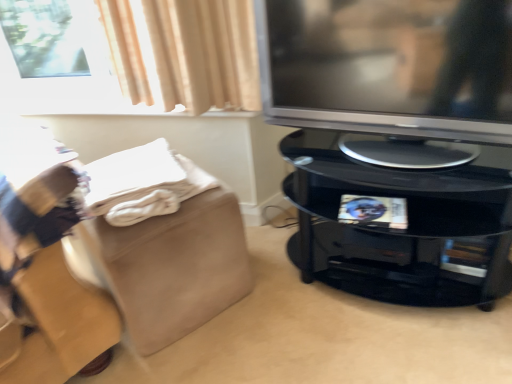
This screenshot has width=512, height=384. What do you see at coordinates (401, 229) in the screenshot?
I see `glossy black tv stand at right` at bounding box center [401, 229].

You are a GUI agent. You are given a task and a screenshot of the screen. Output one action in this format:
    pyautogui.click(x=<x>, y=<y>)
    Task: Click on the white soft blanket at lower left
    The image size is (512, 384).
    Given the screenshot: What is the action you would take?
    pyautogui.click(x=143, y=183)

What do you see at coordinates (175, 267) in the screenshot? I see `beige suede footrest at lower left` at bounding box center [175, 267].

Find the location of a particular element. satin silver television at right is located at coordinates (389, 66).

Is beige suede footrest at lower left aimed at glossy black tv stand at right?

No, beige suede footrest at lower left is not turned towards glossy black tv stand at right.

Is beige suede footrest at lower left to the right of glossy black tv stand at right from the viewer's perspective?

Incorrect, beige suede footrest at lower left is not on the right side of glossy black tv stand at right.

Considering the sizes of beige suede footrest at lower left and glossy black tv stand at right in the image, is beige suede footrest at lower left taller or shorter than glossy black tv stand at right?

Clearly, beige suede footrest at lower left is shorter compared to glossy black tv stand at right.

Considering the sizes of objects beige suede footrest at lower left and glossy black tv stand at right in the image provided, who is bigger, beige suede footrest at lower left or glossy black tv stand at right?

With larger size is glossy black tv stand at right.

From a real-world perspective, which is physically below, white soft blanket at lower left or beige suede footrest at lower left?

In real-world perspective, beige suede footrest at lower left is lower.

Is there a large distance between white soft blanket at lower left and beige suede footrest at lower left?

They are positioned close to each other.

Is white soft blanket at lower left further to the viewer compared to beige suede footrest at lower left?

No, it is in front of beige suede footrest at lower left.

Image resolution: width=512 pixels, height=384 pixels. In order to click on blanket that is above the beige suede footrest at lower left (from a real-world perspective) in this screenshot , I will do `click(143, 183)`.

From the image's perspective, is glossy black tv stand at right located beneath white soft blanket at lower left?

Correct, glossy black tv stand at right appears lower than white soft blanket at lower left in the image.

Is the position of glossy black tv stand at right less distant than that of white soft blanket at lower left?

Yes, it is.

From a real-world perspective, between glossy black tv stand at right and white soft blanket at lower left, who is vertically higher?

white soft blanket at lower left is physically above.

Considering the sizes of satin silver television at right and glossy black tv stand at right in the image, is satin silver television at right taller or shorter than glossy black tv stand at right?

In the image, satin silver television at right appears to be shorter than glossy black tv stand at right.

Considering their positions, is satin silver television at right located in front of or behind glossy black tv stand at right?

Visually, satin silver television at right is located in front of glossy black tv stand at right.

From the image's perspective, which one is positioned higher, satin silver television at right or glossy black tv stand at right?

satin silver television at right, from the image's perspective.

Looking at this image, looking at their sizes, would you say satin silver television at right is wider or thinner than beige suede footrest at lower left?

In the image, satin silver television at right appears to be more narrow than beige suede footrest at lower left.

Can we say satin silver television at right lies outside beige suede footrest at lower left?

Yes, satin silver television at right is not within beige suede footrest at lower left.

Considering the positions of points (288, 13) and (145, 224), is point (288, 13) farther from camera compared to point (145, 224)?

That is True.

Does satin silver television at right lie in front of beige suede footrest at lower left?

Yes, the depth of satin silver television at right is less than that of beige suede footrest at lower left.

From a real-world perspective, is glossy black tv stand at right physically located above or below satin silver television at right?

Clearly, from a real-world perspective, glossy black tv stand at right is below satin silver television at right.

Considering the relative sizes of glossy black tv stand at right and satin silver television at right in the image provided, is glossy black tv stand at right smaller than satin silver television at right?

No, glossy black tv stand at right is not smaller than satin silver television at right.

From the image's perspective, does glossy black tv stand at right appear lower than satin silver television at right?

Yes, from the image's perspective, glossy black tv stand at right is beneath satin silver television at right.

In the scene shown: Considering the sizes of glossy black tv stand at right and satin silver television at right in the image, is glossy black tv stand at right wider or thinner than satin silver television at right?

Clearly, glossy black tv stand at right has more width compared to satin silver television at right.

Does satin silver television at right have a greater height compared to white soft blanket at lower left?

Yes.

The width and height of the screenshot is (512, 384). What are the coordinates of `blanket behind the satin silver television at right` in the screenshot? It's located at (143, 183).

Is satin silver television at right oriented towards white soft blanket at lower left?

No, satin silver television at right is not aimed at white soft blanket at lower left.

Is satin silver television at right placed right next to white soft blanket at lower left?

No, satin silver television at right is not in contact with white soft blanket at lower left.

This screenshot has width=512, height=384. Find the location of `footrest on the left side of glossy black tv stand at right`. footrest on the left side of glossy black tv stand at right is located at coordinates (175, 267).

This screenshot has height=384, width=512. In the image, there is a beige suede footrest at lower left. Find the location of `blanket above it (from the image's perspective)`. blanket above it (from the image's perspective) is located at coordinates (143, 183).

Which object lies nearer to the anchor point white soft blanket at lower left, glossy black tv stand at right or beige suede footrest at lower left?

beige suede footrest at lower left is closer to white soft blanket at lower left.

Considering their positions, is satin silver television at right positioned further to beige suede footrest at lower left than glossy black tv stand at right?

satin silver television at right is positioned further to the anchor beige suede footrest at lower left.

Which object lies further to the anchor point white soft blanket at lower left, satin silver television at right or glossy black tv stand at right?

Among the two, satin silver television at right is located further to white soft blanket at lower left.

Looking at the image, which one is located closer to glossy black tv stand at right, white soft blanket at lower left or beige suede footrest at lower left?

Based on the image, beige suede footrest at lower left appears to be nearer to glossy black tv stand at right.

Based on their spatial positions, is satin silver television at right or beige suede footrest at lower left further from white soft blanket at lower left?

satin silver television at right is positioned further to the anchor white soft blanket at lower left.

When comparing their distances from satin silver television at right, does white soft blanket at lower left or glossy black tv stand at right seem closer?

glossy black tv stand at right.

Which object lies nearer to the anchor point glossy black tv stand at right, white soft blanket at lower left or satin silver television at right?

satin silver television at right is closer to glossy black tv stand at right.

When comparing their distances from satin silver television at right, does beige suede footrest at lower left or white soft blanket at lower left seem further?

beige suede footrest at lower left.

Locate an element on the screen. The width and height of the screenshot is (512, 384). the footrest situated between white soft blanket at lower left and glossy black tv stand at right from left to right is located at coordinates (175, 267).

Find the location of a particular element. This screenshot has width=512, height=384. the footrest located between white soft blanket at lower left and satin silver television at right in the left-right direction is located at coordinates (175, 267).

The width and height of the screenshot is (512, 384). In order to click on television between white soft blanket at lower left and glossy black tv stand at right from left to right in this screenshot , I will do `click(389, 66)`.

In order to click on television between beige suede footrest at lower left and glossy black tv stand at right from left to right in this screenshot , I will do `click(389, 66)`.